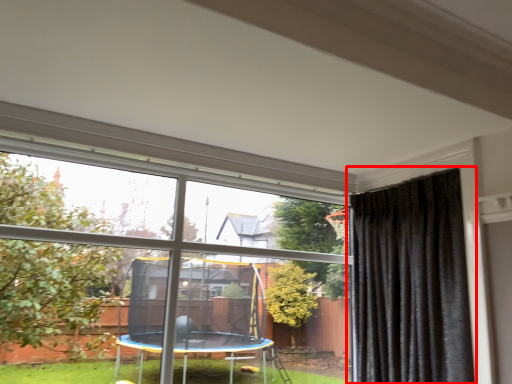
Question: Considering the relative positions of curtain (annotated by the red box) and window in the image provided, where is curtain (annotated by the red box) located with respect to the staircase?

Choices:
 (A) right
 (B) left

Answer: (A)